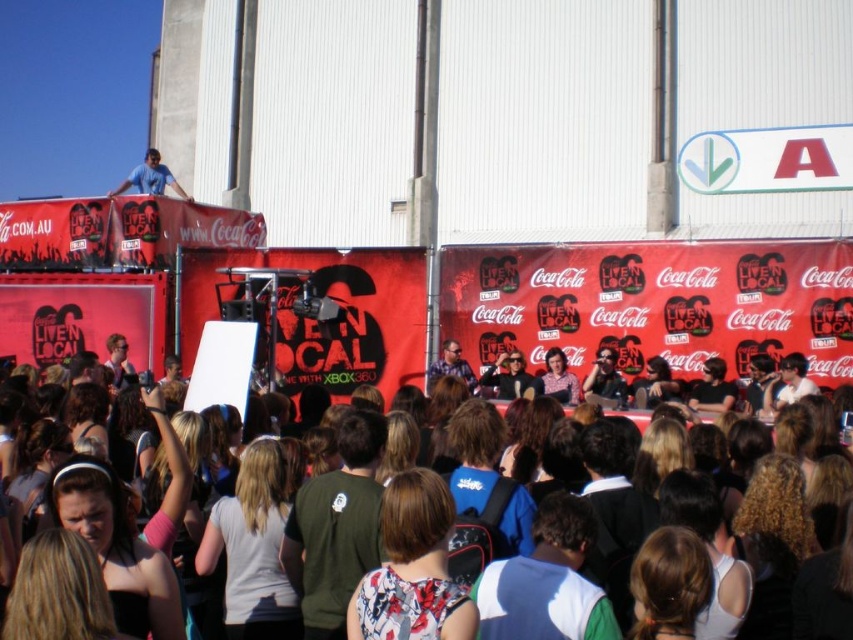
You are a photographer trying to capture a clear shot of the person at the center of the stage. You notice the brown hair at center and the matte black sunglasses at center. Which object should you focus on to ensure the other is in the background?

You should focus on the brown hair at center because it is in front of the matte black sunglasses at center, so focusing on it will keep the sunglasses in the background.

You are standing at the center of the stage and see a point marked at coordinates (195, 422). What is located at that point?

At point (195, 422) lies brown hair at center.

You are at the event and want to take a photo of the stage. You notice the brown hair at center and the matte blue shirt at upper left. Which object should you focus on first if you want to capture both in one frame without moving the camera?

You should focus on the brown hair at center first because it is positioned to the right of the matte blue shirt at upper left, so centering the camera on the brown hair at center will allow both objects to be included in the frame.